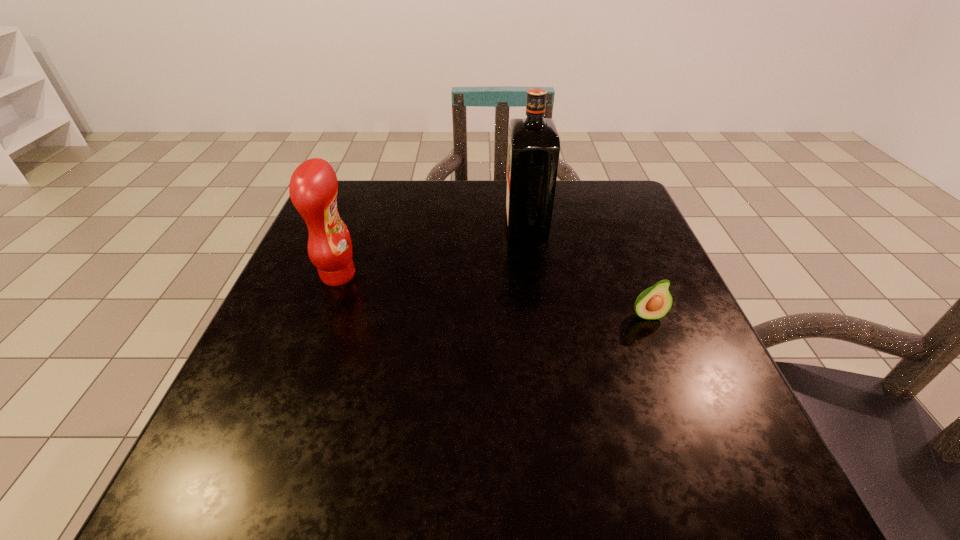
The height and width of the screenshot is (540, 960). In order to click on free space between the second tallest object and the second object from left to right in this screenshot , I will do `click(432, 250)`.

At what (x,y) coordinates should I click in order to perform the action: click on empty location between the second nearest object and the second object from right to left. Please return your answer as a coordinate pair (x, y). Image resolution: width=960 pixels, height=540 pixels. Looking at the image, I should click on (432, 250).

Identify the location of blank region between the nearest object and the second object from left to right. (587, 270).

What are the coordinates of `free space that is in between the avocado and the second object from left to right` in the screenshot? It's located at (587, 270).

Locate an element on the screen. empty location between the liquor and the condiment is located at coordinates (432, 250).

At what (x,y) coordinates should I click in order to perform the action: click on unoccupied area between the avocado and the liquor. Please return your answer as a coordinate pair (x, y). Image resolution: width=960 pixels, height=540 pixels. Looking at the image, I should click on tap(587, 270).

Identify the location of unoccupied area between the second tallest object and the nearest object. (492, 295).

You are a GUI agent. You are given a task and a screenshot of the screen. Output one action in this format:
    pyautogui.click(x=<x>, y=<y>)
    Task: Click on the free space that is in between the second farthest object and the shortest object
    
    Given the screenshot: What is the action you would take?
    pyautogui.click(x=492, y=295)

Locate an element on the screen. vacant space in between the avocado and the second nearest object is located at coordinates (492, 295).

You are a GUI agent. You are given a task and a screenshot of the screen. Output one action in this format:
    pyautogui.click(x=<x>, y=<y>)
    Task: Click on the object that is the closest to the avocado
    This screenshot has width=960, height=540.
    Given the screenshot: What is the action you would take?
    pyautogui.click(x=534, y=145)